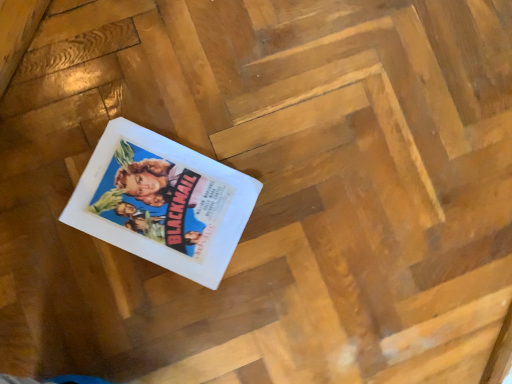
Where is `free point above white paper at center (from a real-world perspective)`? Image resolution: width=512 pixels, height=384 pixels. free point above white paper at center (from a real-world perspective) is located at coordinates (157, 208).